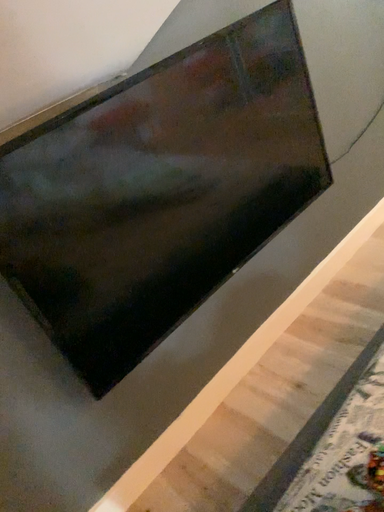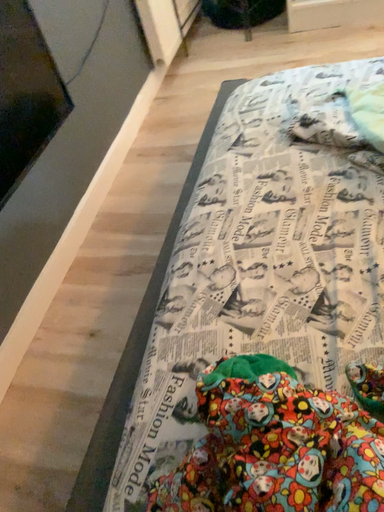
Question: How did the camera likely rotate when shooting the video?

Choices:
 (A) rotated left
 (B) rotated right

Answer: (B)